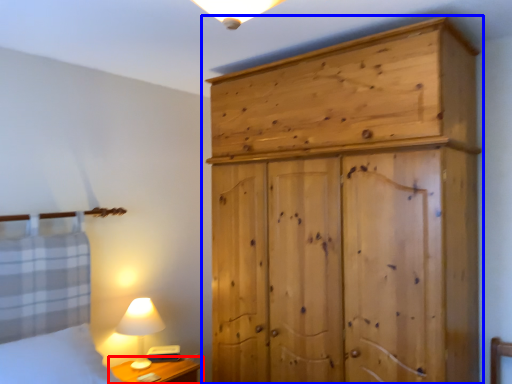
Question: Among these objects, which one is farthest to the camera, nightstand (highlighted by a red box) or cupboard (highlighted by a blue box)?

Choices:
 (A) nightstand
 (B) cupboard

Answer: (A)